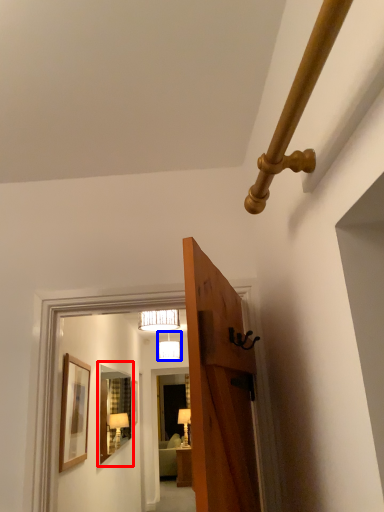
Question: Which of the following is the farthest to the observer, mirror (highlighted by a red box) or lamp (highlighted by a blue box)?

Choices:
 (A) mirror
 (B) lamp

Answer: (B)